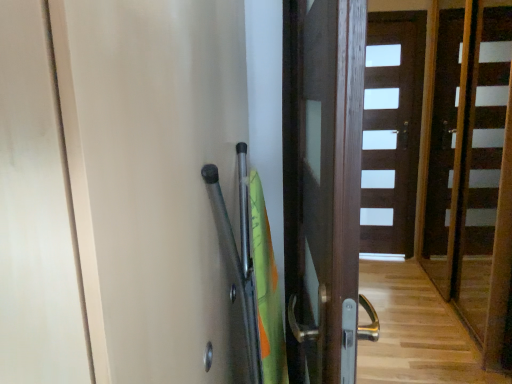
Image resolution: width=512 pixels, height=384 pixels. I want to click on transparent plastic screen door at upper right, so pos(154,180).

Where is `dark wood door at center, arranged as the 2th door when viewed from the right`? dark wood door at center, arranged as the 2th door when viewed from the right is located at coordinates (323, 187).

Locate an element on the screen. wooden stairs at center is located at coordinates (481, 159).

Which of these two, transparent plastic screen door at upper right or brown wooden door at center, which ranks as the second door in left-to-right order, is thinner?

brown wooden door at center, which ranks as the second door in left-to-right order, is thinner.

Is transparent plastic screen door at upper right positioned with its back to brown wooden door at center, the 2th door positioned from the front?

transparent plastic screen door at upper right is not turned away from brown wooden door at center, the 2th door positioned from the front.

In the scene shown: Does transparent plastic screen door at upper right have a greater height compared to brown wooden door at center, which is the first door in right-to-left order?

No, transparent plastic screen door at upper right is not taller than brown wooden door at center, which is the first door in right-to-left order.

Considering the sizes of transparent plastic screen door at upper right and brown wooden door at center, which is the first door in right-to-left order, in the image, is transparent plastic screen door at upper right bigger or smaller than brown wooden door at center, which is the first door in right-to-left order,?

In the image, transparent plastic screen door at upper right appears to be larger than brown wooden door at center, which is the first door in right-to-left order.

Which of these two, transparent plastic screen door at upper right or dark wood door at center, positioned as the 2th door in back-to-front order, is bigger?

transparent plastic screen door at upper right.

Between transparent plastic screen door at upper right and dark wood door at center, arranged as the first door when viewed from the front, which one is positioned behind?

dark wood door at center, arranged as the first door when viewed from the front, is further from the camera.

Does transparent plastic screen door at upper right have a greater height compared to dark wood door at center, arranged as the first door when viewed from the front?

Yes, transparent plastic screen door at upper right is taller than dark wood door at center, arranged as the first door when viewed from the front.

Is transparent plastic screen door at upper right positioned beyond the bounds of dark wood door at center, arranged as the first door when viewed from the left?

Yes, transparent plastic screen door at upper right is outside of dark wood door at center, arranged as the first door when viewed from the left.

Is transparent plastic screen door at upper right surrounded by brown wooden door at center, the 2th door positioned from the front?

No, transparent plastic screen door at upper right is located outside of brown wooden door at center, the 2th door positioned from the front.

From the image's perspective, is brown wooden door at center, the 1th door in the back-to-front sequence, on top of transparent plastic screen door at upper right?

Yes, from the image's perspective, brown wooden door at center, the 1th door in the back-to-front sequence, is above transparent plastic screen door at upper right.

Is brown wooden door at center, which ranks as the second door in left-to-right order, wider than transparent plastic screen door at upper right?

No.

Is brown wooden door at center, which ranks as the second door in left-to-right order, facing away from wooden stairs at center?

No, wooden stairs at center is not at the back of brown wooden door at center, which ranks as the second door in left-to-right order.

From a real-world perspective, between brown wooden door at center, the 1th door in the back-to-front sequence, and wooden stairs at center, who is vertically lower?

From a 3D spatial view, brown wooden door at center, the 1th door in the back-to-front sequence, is below.

From the picture: Can we say brown wooden door at center, the 1th door in the back-to-front sequence, lies outside wooden stairs at center?

Yes, brown wooden door at center, the 1th door in the back-to-front sequence, is not within wooden stairs at center.

How many degrees apart are the facing directions of brown wooden door at center, which is the first door in right-to-left order, and dark wood door at center, positioned as the 2th door in back-to-front order?

They differ by 7.49 degrees in their facing directions.

From a real-world perspective, is brown wooden door at center, which ranks as the second door in left-to-right order, above or below dark wood door at center, positioned as the 2th door in back-to-front order?

Clearly, from a real-world perspective, brown wooden door at center, which ranks as the second door in left-to-right order, is below dark wood door at center, positioned as the 2th door in back-to-front order.

Based on the photo, between brown wooden door at center, which ranks as the second door in left-to-right order, and dark wood door at center, positioned as the 2th door in back-to-front order, which one appears on the right side from the viewer's perspective?

From the viewer's perspective, brown wooden door at center, which ranks as the second door in left-to-right order, appears more on the right side.

Is brown wooden door at center, which is the first door in right-to-left order, facing away from dark wood door at center, arranged as the first door when viewed from the left?

No, dark wood door at center, arranged as the first door when viewed from the left, is not at the back of brown wooden door at center, which is the first door in right-to-left order.

In the scene shown: From a real-world perspective, who is located lower, transparent plastic screen door at upper right or wooden stairs at center?

wooden stairs at center, from a real-world perspective.

In terms of size, does transparent plastic screen door at upper right appear bigger or smaller than wooden stairs at center?

In the image, transparent plastic screen door at upper right appears to be smaller than wooden stairs at center.

Can you confirm if transparent plastic screen door at upper right is shorter than wooden stairs at center?

Yes, transparent plastic screen door at upper right is shorter than wooden stairs at center.

Would you say transparent plastic screen door at upper right is a long distance from wooden stairs at center?

Indeed, transparent plastic screen door at upper right is not near wooden stairs at center.

Does dark wood door at center, arranged as the first door when viewed from the front, have a greater width compared to brown wooden door at center, the 1th door in the back-to-front sequence?

Yes.

Is dark wood door at center, arranged as the 2th door when viewed from the right, in contact with brown wooden door at center, the 2th door positioned from the front?

No, dark wood door at center, arranged as the 2th door when viewed from the right, is not touching brown wooden door at center, the 2th door positioned from the front.

Does dark wood door at center, arranged as the 2th door when viewed from the right, come in front of brown wooden door at center, the 2th door positioned from the front?

Yes, the depth of dark wood door at center, arranged as the 2th door when viewed from the right, is less than that of brown wooden door at center, the 2th door positioned from the front.

Is dark wood door at center, arranged as the 2th door when viewed from the right, outside of brown wooden door at center, which ranks as the second door in left-to-right order?

dark wood door at center, arranged as the 2th door when viewed from the right, is positioned outside brown wooden door at center, which ranks as the second door in left-to-right order.

From the transparent plastic screen door at upper right, count 2nd doors backward and point to it. Please provide its 2D coordinates.

[(391, 131)]

The height and width of the screenshot is (384, 512). What are the coordinates of `screen door in front of the dark wood door at center, arranged as the first door when viewed from the front` in the screenshot? It's located at (154, 180).

Considering their positions, is brown wooden door at center, which ranks as the second door in left-to-right order, positioned closer to wooden stairs at center than transparent plastic screen door at upper right?

brown wooden door at center, which ranks as the second door in left-to-right order, is positioned closer to the anchor wooden stairs at center.

Consider the image. Looking at the image, which one is located closer to brown wooden door at center, which ranks as the second door in left-to-right order, wooden stairs at center or transparent plastic screen door at upper right?

The object closer to brown wooden door at center, which ranks as the second door in left-to-right order, is wooden stairs at center.

Estimate the real-world distances between objects in this image. Which object is further from transparent plastic screen door at upper right, wooden stairs at center or brown wooden door at center, the 1th door in the back-to-front sequence?

brown wooden door at center, the 1th door in the back-to-front sequence, lies further to transparent plastic screen door at upper right than the other object.

When comparing their distances from transparent plastic screen door at upper right, does brown wooden door at center, which is the first door in right-to-left order, or dark wood door at center, positioned as the 2th door in back-to-front order, seem closer?

The object closer to transparent plastic screen door at upper right is dark wood door at center, positioned as the 2th door in back-to-front order.

Based on their spatial positions, is dark wood door at center, positioned as the 2th door in back-to-front order, or wooden stairs at center closer to brown wooden door at center, the 2th door positioned from the front?

Based on the image, wooden stairs at center appears to be nearer to brown wooden door at center, the 2th door positioned from the front.

Considering their positions, is dark wood door at center, arranged as the 2th door when viewed from the right, positioned further to wooden stairs at center than brown wooden door at center, which ranks as the second door in left-to-right order?

Among the two, dark wood door at center, arranged as the 2th door when viewed from the right, is located further to wooden stairs at center.

From the image, which object appears to be farther from dark wood door at center, arranged as the 2th door when viewed from the right, transparent plastic screen door at upper right or brown wooden door at center, which ranks as the second door in left-to-right order?

Answer: Based on the image, brown wooden door at center, which ranks as the second door in left-to-right order, appears to be further to dark wood door at center, arranged as the 2th door when viewed from the right.

Which object lies nearer to the anchor point wooden stairs at center, brown wooden door at center, which ranks as the second door in left-to-right order, or dark wood door at center, arranged as the first door when viewed from the left?

brown wooden door at center, which ranks as the second door in left-to-right order.

Locate an element on the screen. This screenshot has width=512, height=384. stair positioned between dark wood door at center, arranged as the first door when viewed from the left, and brown wooden door at center, the 2th door positioned from the front, from near to far is located at coordinates (481, 159).

You are a GUI agent. You are given a task and a screenshot of the screen. Output one action in this format:
    pyautogui.click(x=<x>, y=<y>)
    Task: Click on the stair positioned between transparent plastic screen door at upper right and brown wooden door at center, which is the first door in right-to-left order, from near to far
    Image resolution: width=512 pixels, height=384 pixels.
    Given the screenshot: What is the action you would take?
    pyautogui.click(x=481, y=159)

Where is `door between transparent plastic screen door at upper right and brown wooden door at center, the 1th door in the back-to-front sequence, along the z-axis`? The image size is (512, 384). door between transparent plastic screen door at upper right and brown wooden door at center, the 1th door in the back-to-front sequence, along the z-axis is located at coordinates (323, 187).